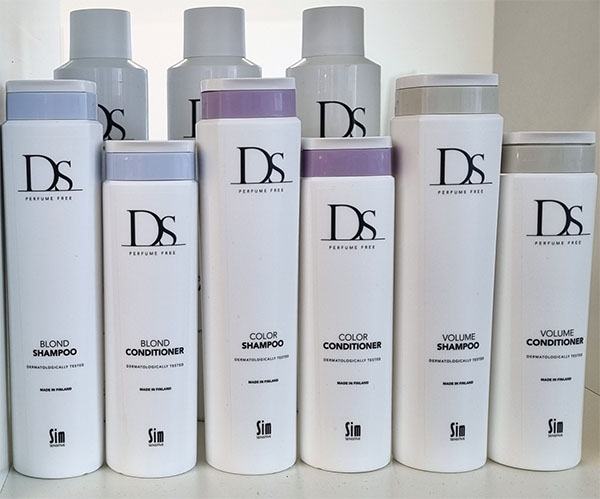
What are the coordinates of `bottles` in the screenshot? It's located at (542, 263), (441, 256), (331, 101), (343, 225), (253, 250), (204, 52), (156, 232), (54, 227), (101, 57).